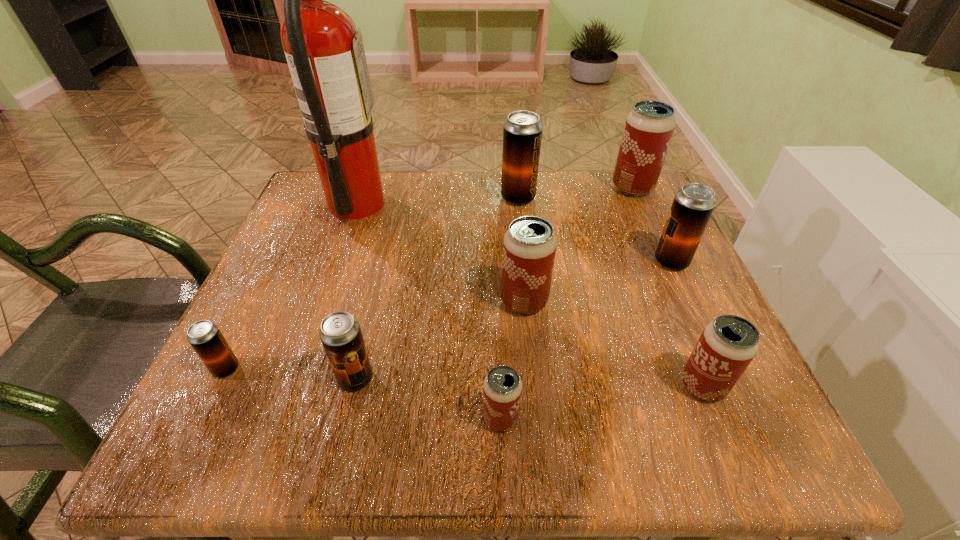
Identify the location of vacant point located between the third biggest red beer can and the biggest red beer can. The width and height of the screenshot is (960, 540). (668, 287).

Where is `vacant space in between the smallest red beer can and the farthest red beer can`? vacant space in between the smallest red beer can and the farthest red beer can is located at coordinates (566, 303).

Identify the location of free spot between the second farthest red beer can and the leftmost beer can. The height and width of the screenshot is (540, 960). (375, 335).

Locate an element on the screen. vacant area between the third nearest red beer can and the red fire extinguisher is located at coordinates (441, 253).

Find the location of a particular element. The image size is (960, 540). free space that is in between the fire extinguisher and the fifth nearest beer can is located at coordinates [x=441, y=253].

Find the location of a particular element. This screenshot has height=540, width=960. object that can be found as the seventh closest to the smallest red beer can is located at coordinates (522, 132).

This screenshot has height=540, width=960. I want to click on the second closest object to the smallest red beer can, so click(x=340, y=333).

Locate an element on the screen. The height and width of the screenshot is (540, 960). beer can that is the second closest one to the farthest red beer can is located at coordinates (522, 132).

At what (x,y) coordinates should I click in order to perform the action: click on beer can that is the fifth closest to the third biggest red beer can. Please return your answer as a coordinate pair (x, y). Looking at the image, I should click on (522, 132).

You are a GUI agent. You are given a task and a screenshot of the screen. Output one action in this format:
    pyautogui.click(x=<x>, y=<y>)
    Task: Click on the second closest black beer can to the red fire extinguisher
    This screenshot has width=960, height=540.
    Given the screenshot: What is the action you would take?
    pyautogui.click(x=206, y=339)